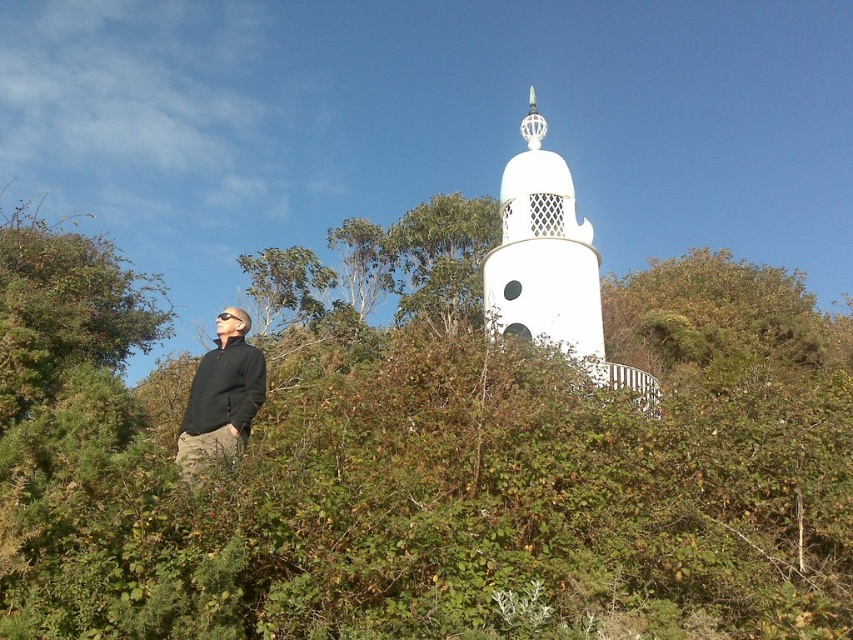
The image size is (853, 640). In order to click on green leafy bush at center in this screenshot , I will do `click(424, 461)`.

Does point (122, 390) lie in front of point (228, 356)?

No, (122, 390) is further to viewer.

Between point (805, 541) and point (242, 381), which one is positioned behind?

Point (242, 381)

Identify the location of green leafy bush at center. This screenshot has width=853, height=640. (424, 461).

Does white matte tower at center come in front of black matte jacket at lower left?

No, white matte tower at center is further to the viewer.

Is white matte tower at center behind black matte jacket at lower left?

Yes, white matte tower at center is further from the viewer.

Who is more distant from viewer, (492, 272) or (248, 369)?

Positioned behind is point (492, 272).

At what (x,y) coordinates should I click in order to perform the action: click on white matte tower at center. Please return your answer as a coordinate pair (x, y). Looking at the image, I should click on (544, 257).

Which is behind, point (38, 259) or point (529, 324)?

The point (38, 259) is behind.

Which is more to the left, green leafy bush at center or white matte tower at center?

From the viewer's perspective, green leafy bush at center appears more on the left side.

Where is `green leafy bush at center`? green leafy bush at center is located at coordinates (424, 461).